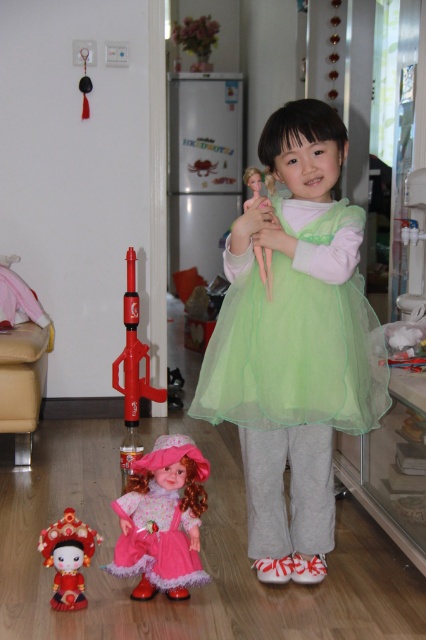
This screenshot has height=640, width=426. I want to click on rubberized red toy gun at center, so click(x=132, y=372).

Is rubberized red toy gun at center taller than smooth plastic doll at center?

Yes.

Which is behind, point (134, 323) or point (258, 248)?

Point (134, 323)

Locate an element on the screen. The image size is (426, 640). rubberized red toy gun at center is located at coordinates (132, 372).

Who is positioned more to the left, pink fabric doll at lower center or rubberized red toy gun at center?

Positioned to the left is rubberized red toy gun at center.

Consider the image. Is pink fabric doll at lower center smaller than rubberized red toy gun at center?

Correct, pink fabric doll at lower center occupies less space than rubberized red toy gun at center.

Which is in front, point (173, 586) or point (120, 458)?

Positioned in front is point (173, 586).

Identify the location of pink fabric doll at lower center. click(x=163, y=518).

Does rubberized red toy gun at center appear under matte red doll at lower left?

Actually, rubberized red toy gun at center is above matte red doll at lower left.

The image size is (426, 640). I want to click on rubberized red toy gun at center, so click(132, 372).